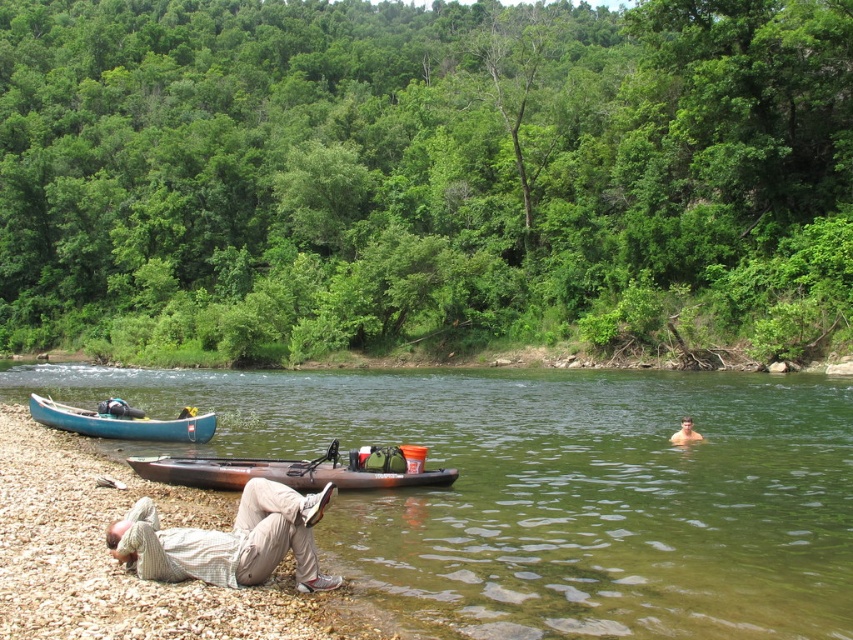
Who is taller, light brown cotton pants at lower left or blue plastic canoe at lower left?

blue plastic canoe at lower left

Between light brown cotton pants at lower left and blue plastic canoe at lower left, which one is positioned lower?

blue plastic canoe at lower left is lower down.

Is point (294, 515) positioned behind point (57, 426)?

No, (294, 515) is in front of (57, 426).

Locate an element on the screen. This screenshot has height=640, width=853. light brown cotton pants at lower left is located at coordinates (227, 540).

Consider the image. How far apart are green water at center and smooth skin at water right?

green water at center and smooth skin at water right are 14.83 meters apart.

Can you confirm if green water at center is wider than smooth skin at water right?

Indeed, green water at center has a greater width compared to smooth skin at water right.

Is point (563, 376) positioned in front of point (683, 435)?

No, it is behind (683, 435).

This screenshot has width=853, height=640. What are the coordinates of `green water at center` in the screenshot? It's located at (x=553, y=490).

Is brown matte kayak at center closer to camera compared to smooth skin at water right?

Yes, brown matte kayak at center is in front of smooth skin at water right.

Is brown matte kayak at center above smooth skin at water right?

Indeed, brown matte kayak at center is positioned over smooth skin at water right.

Which is in front, point (315, 464) or point (688, 436)?

Point (315, 464) is in front.

Image resolution: width=853 pixels, height=640 pixels. In order to click on brown matte kayak at center in this screenshot , I will do `click(285, 472)`.